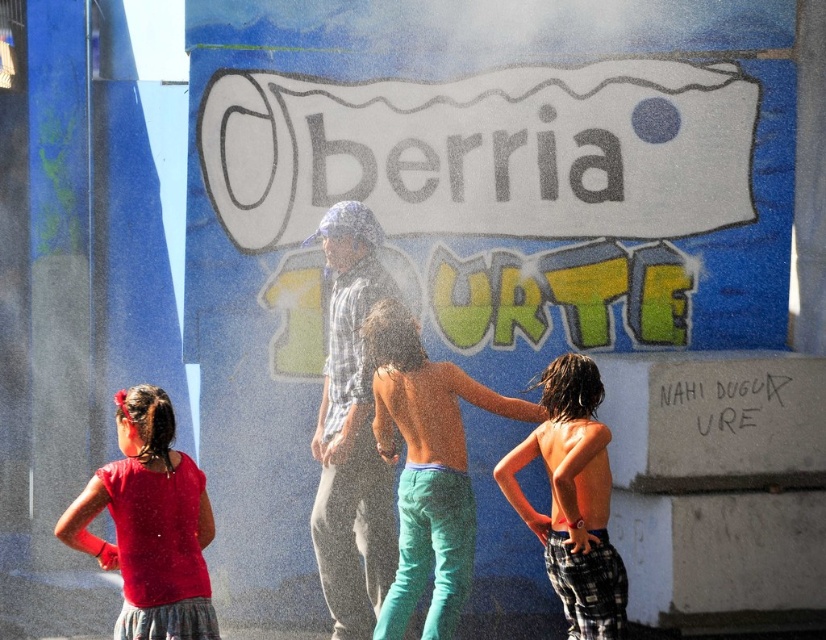
Question: Which of the following is the farthest from the observer?

Choices:
 (A) (457, 520)
 (B) (169, 420)

Answer: (A)

Question: Can you confirm if matte red shirt at lower left is positioned above plaid cotton shorts at center?

Choices:
 (A) yes
 (B) no

Answer: (B)

Question: Which of the following is the closest to the observer?

Choices:
 (A) matte red shirt at lower left
 (B) teal cotton pants at center

Answer: (A)

Question: Is matte red shirt at lower left thinner than plaid cotton shorts at center?

Choices:
 (A) no
 (B) yes

Answer: (A)

Question: Which point appears closest to the camera in this image?

Choices:
 (A) (611, 612)
 (B) (435, 433)

Answer: (A)

Question: Observing the image, what is the correct spatial positioning of teal cotton pants at center in reference to plaid cotton shorts at center?

Choices:
 (A) above
 (B) below

Answer: (A)